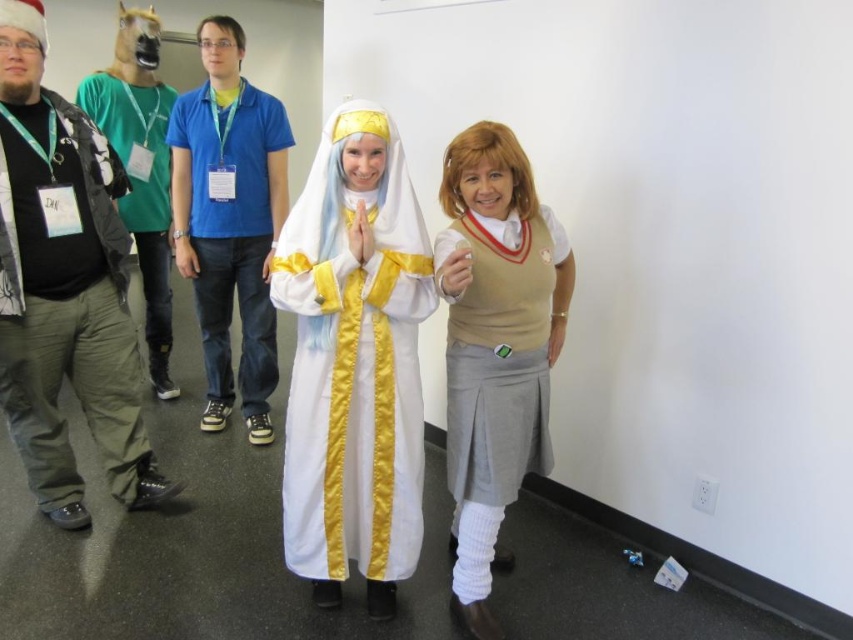
You are organizing a costume party and need to arrange the beige knit sweater at center and the blue cotton shirt at center on a display rack. Which item should you place first to ensure both fit on the rack?

The beige knit sweater at center occupies less space than the blue cotton shirt at center, so you should place the blue cotton shirt at center first to ensure there is enough space for both items.